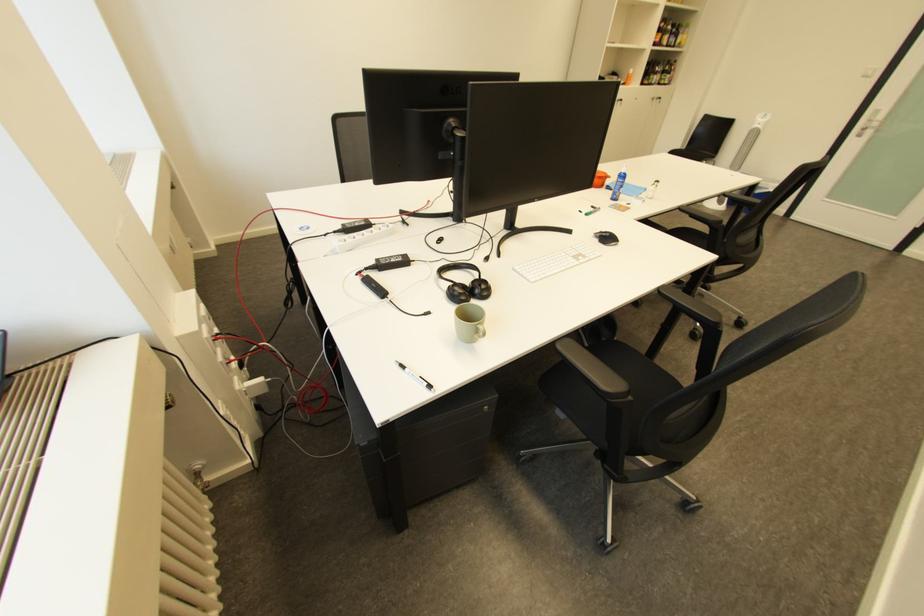
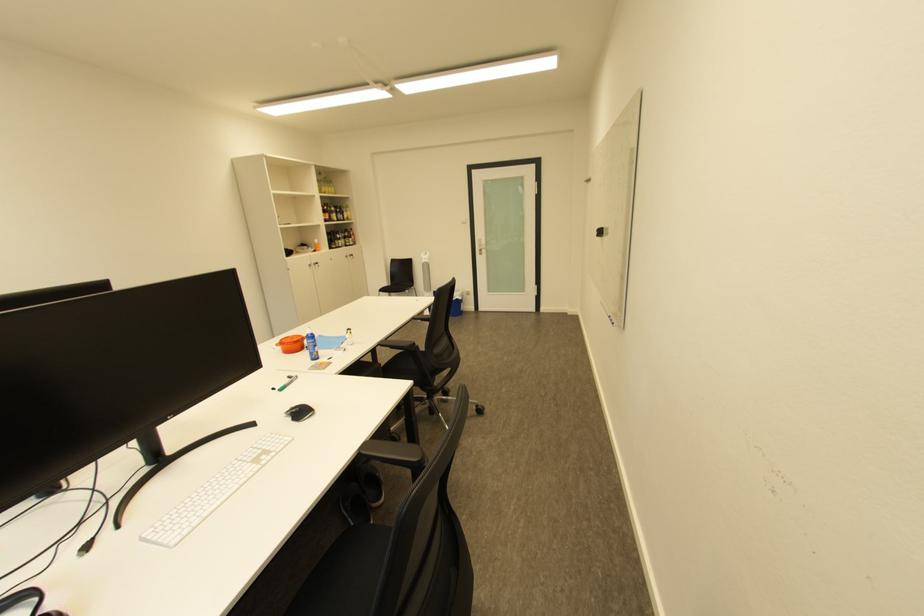
Find the pixel in the second image that matches point (657, 78) in the first image.

(343, 244)